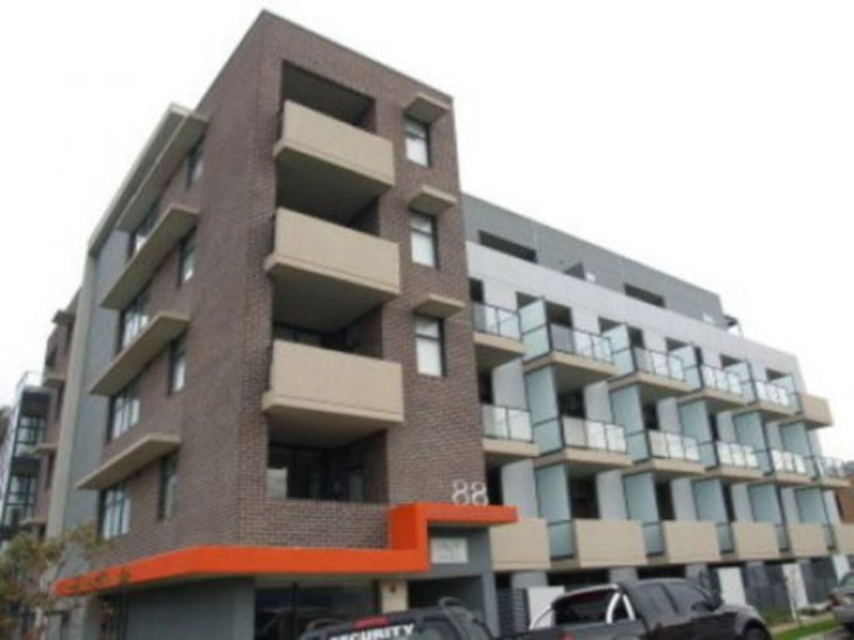
Question: Estimate the real-world distances between objects in this image. Which object is farther from the shiny black car at lower right?

Choices:
 (A) shiny black car at lower center
 (B) black rubber security car at lower center

Answer: (B)

Question: Is shiny black car at lower center positioned in front of black rubber security car at lower center?

Choices:
 (A) no
 (B) yes

Answer: (A)

Question: Which of the following is the farthest from the observer?

Choices:
 (A) shiny black car at lower center
 (B) shiny black car at lower right
 (C) black rubber security car at lower center

Answer: (B)

Question: Which point is farther to the camera?

Choices:
 (A) (407, 612)
 (B) (763, 636)
 (C) (851, 620)

Answer: (C)

Question: Can you confirm if shiny black car at lower center is thinner than shiny black car at lower right?

Choices:
 (A) yes
 (B) no

Answer: (B)

Question: Is black rubber security car at lower center above shiny black car at lower right?

Choices:
 (A) no
 (B) yes

Answer: (B)